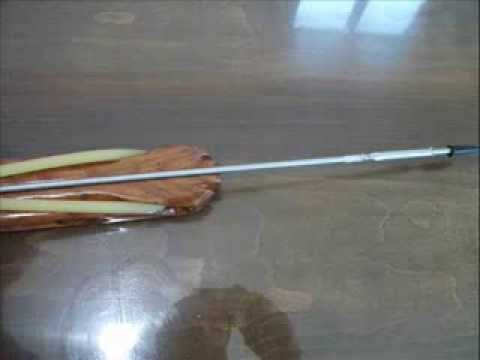
The image size is (480, 360). Find the location of `brown polished wood surface`. brown polished wood surface is located at coordinates (129, 165), (127, 189), (42, 220).